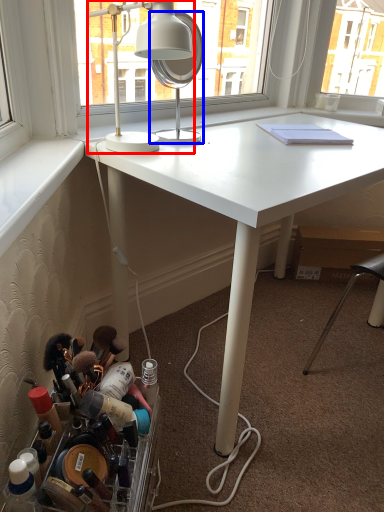
Question: Which point is further to the camera, lamp (highlighted by a red box) or mirror (highlighted by a blue box)?

Choices:
 (A) lamp
 (B) mirror

Answer: (B)